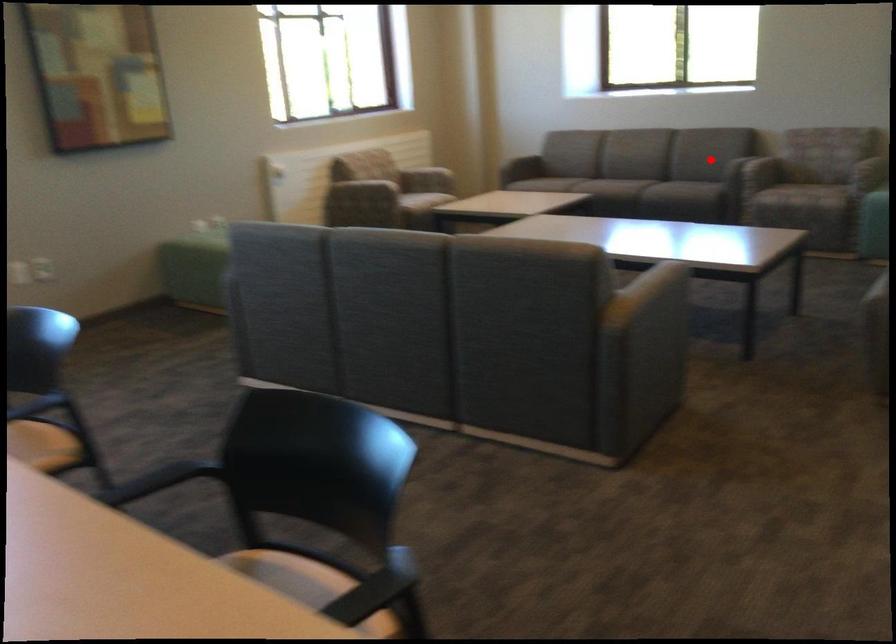
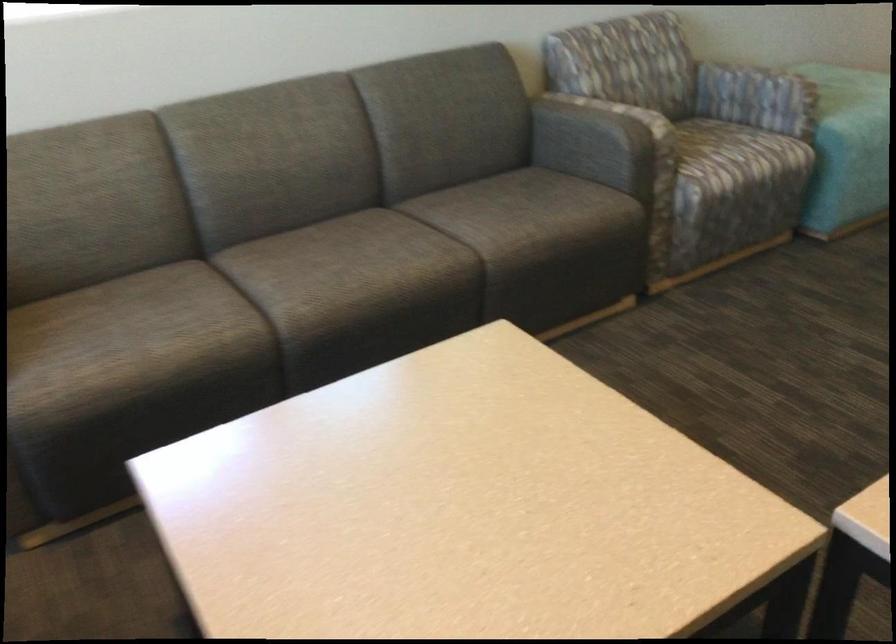
Find the pixel in the second image that matches the highlighted location in the first image.

(597, 140)